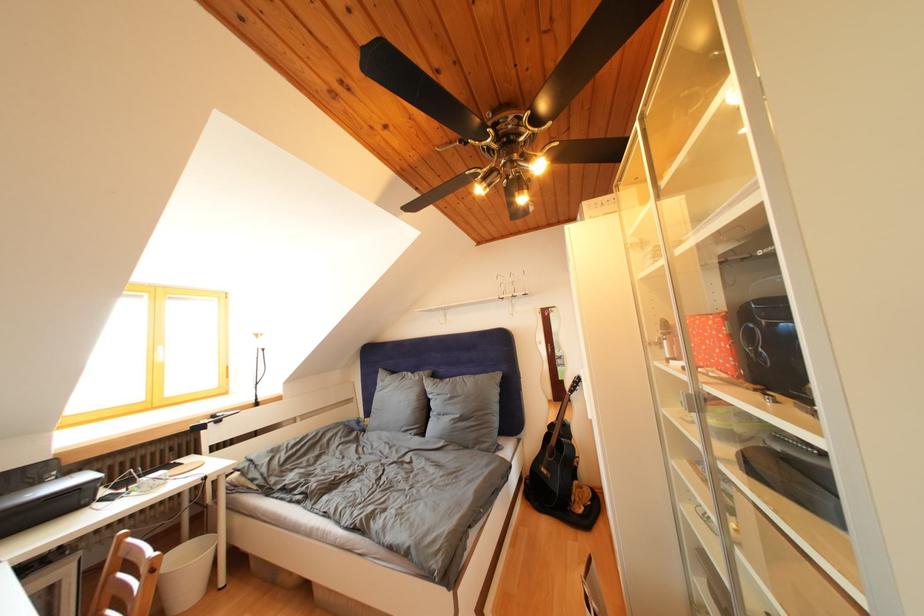
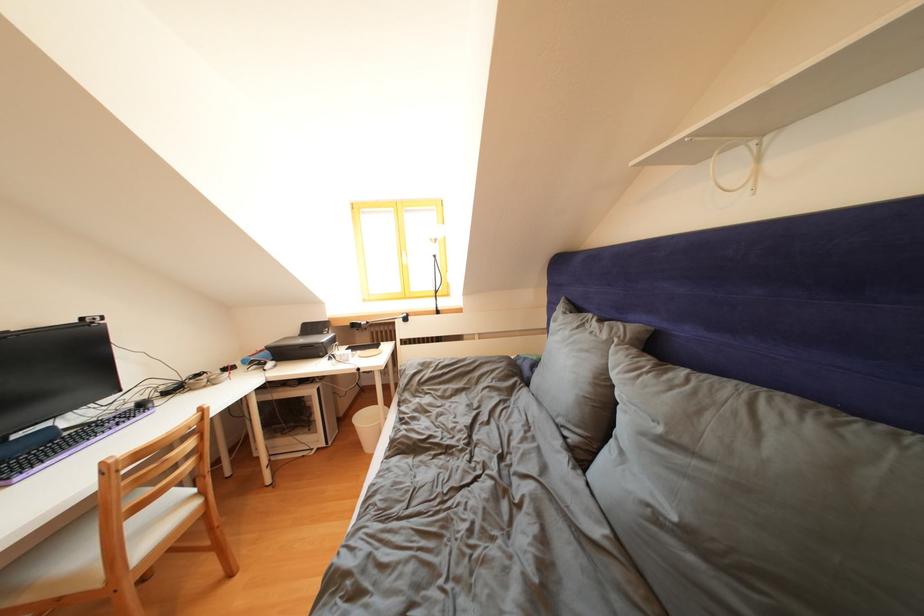
Find the pixel in the second image that matches (x=426, y=383) in the first image.

(612, 341)